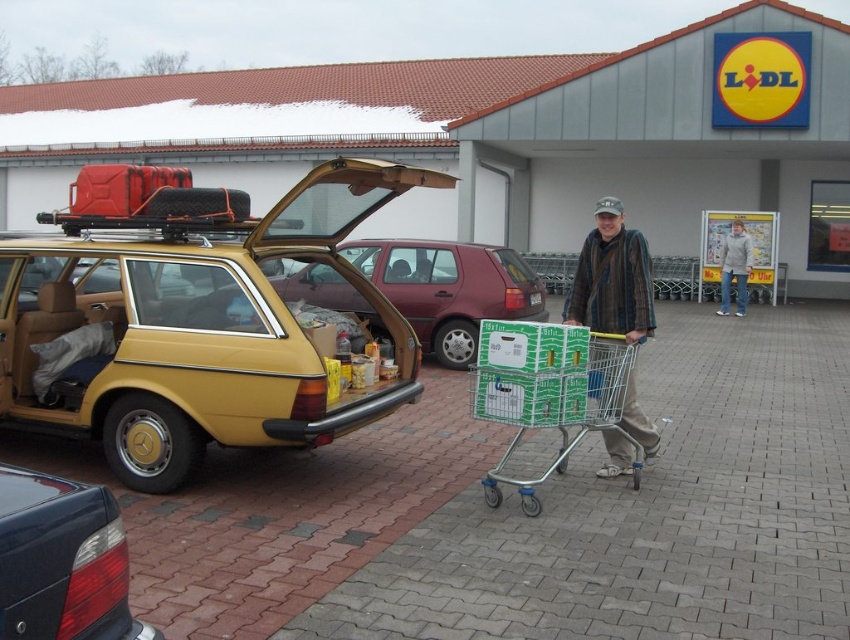
Based on the photo, you are a delivery person who needs to place a large package in the trunk of the vintage yellow Mercedes Benz station wagon. The package is wider than the striped fabric jacket at center but narrower than the gray woolen sweater at center. Will the package fit in the trunk?

The striped fabric jacket at center has a lesser width compared to gray woolen sweater at center. Since the package is wider than the striped fabric jacket at center but narrower than the gray woolen sweater at center, it may or may not fit depending on the trunk space. However, the description only provides relative size between the two items, not the trunk dimensions. Without knowing the trunk size, we cannot determine if the package will fit.

You are standing in front of the Lidl supermarket and want to locate the shiny black tail light at lower left. According to the coordinates given, where exactly is it positioned?

The shiny black tail light at lower left is positioned at point 0.877 on the x axis and 0.074 on the y axis.